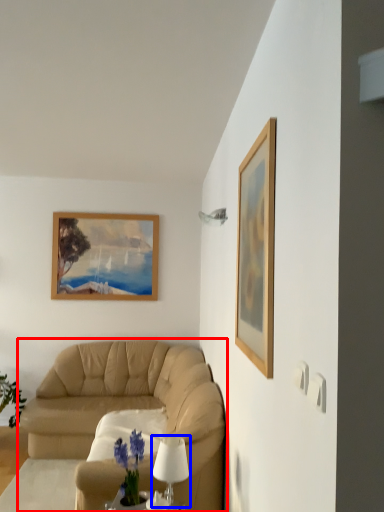
Question: Which point is further to the camera, studio couch (highlighted by a red box) or table lamp (highlighted by a blue box)?

Choices:
 (A) studio couch
 (B) table lamp

Answer: (A)